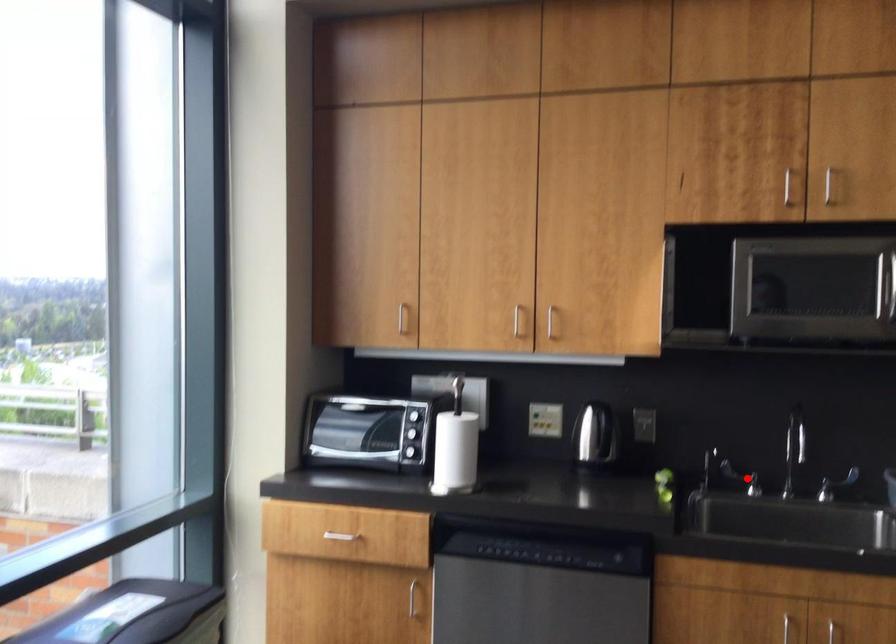
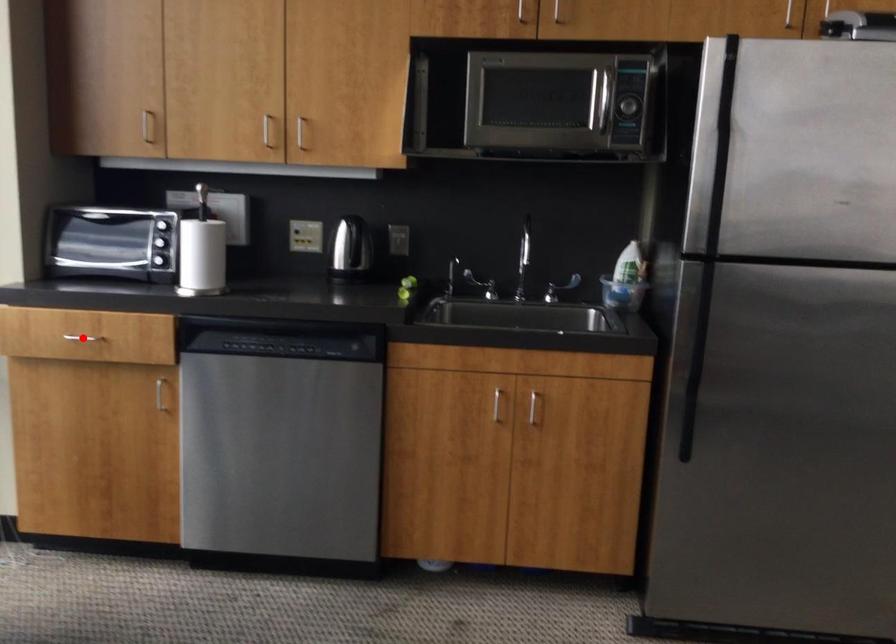
I am providing you with two images of the same scene from different viewpoints. A red point is marked on the first image and another point is marked on the second image. Do the highlighted points in image1 and image2 indicate the same real-world spot?

No